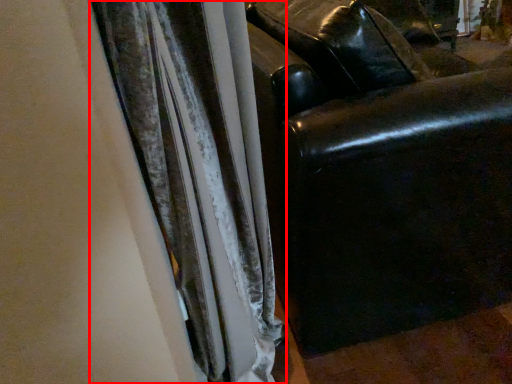
Question: From the image's perspective, what is the correct spatial relationship of curtain (annotated by the red box) in relation to furniture?

Choices:
 (A) above
 (B) below

Answer: (B)